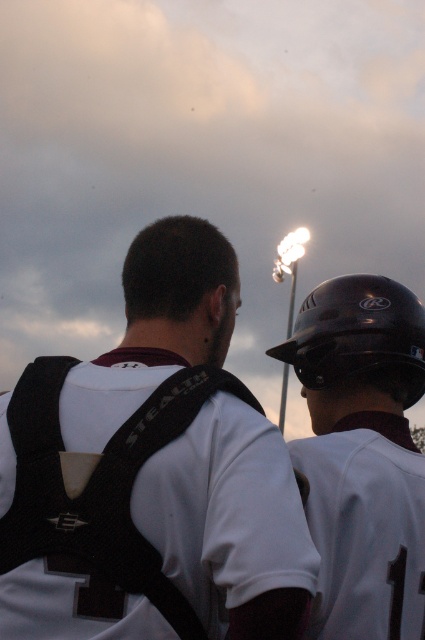
You are a photographer trying to capture a clear shot of both the matte black helmet at upper right and the white jersey at upper right. Which object should you focus on first if you want to ensure both are in focus, considering their sizes?

The matte black helmet at upper right has a larger size compared to the white jersey at upper right. To ensure both are in focus, you should focus on the larger matte black helmet at upper right first, as it requires more precise focus due to its size.

You are standing at the origin point of the coordinate system in the image. You see a matte black helmet at upper right located at point (152,472). If you want to move towards the matte black helmet at upper right, which direction should you move in terms of the coordinate system?

To move towards the matte black helmet at upper right located at point (152,472) from the origin, you should move in the positive x and positive y direction since the coordinates are higher than the origin.